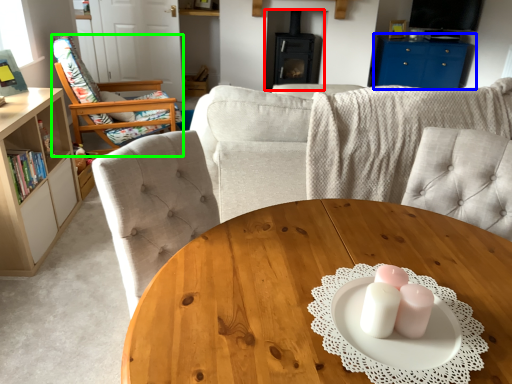
Question: Which is farther away from fireplace (highlighted by a red box)? entertainment center (highlighted by a blue box) or chair (highlighted by a green box)?

Choices:
 (A) entertainment center
 (B) chair

Answer: (B)